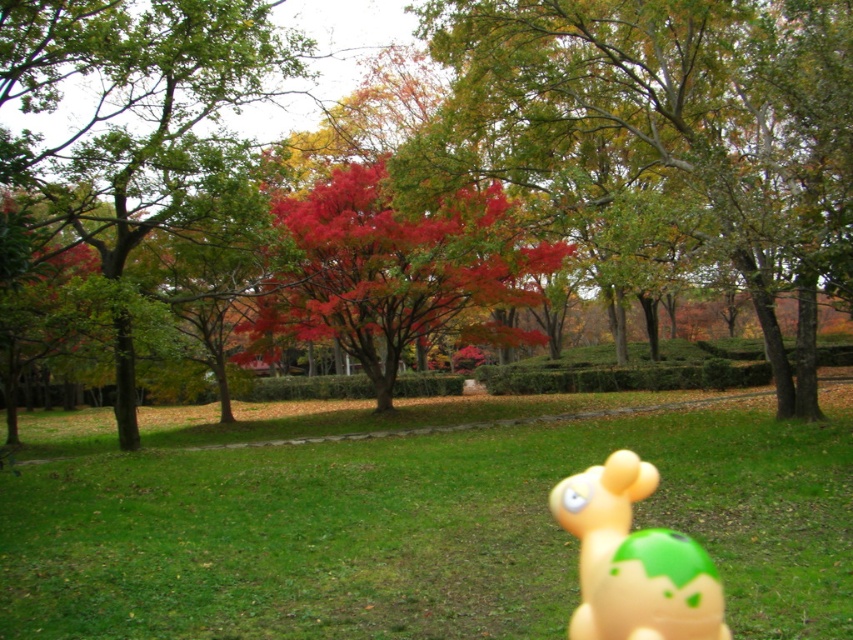
Question: Which of these objects is positioned farthest from the green leafy tree at upper center?

Choices:
 (A) rubber duck at lower right
 (B) reddish-brown bark tree at upper left
 (C) vivid red leaves at center

Answer: (A)

Question: Is green grass at center thinner than green leafy tree at upper center?

Choices:
 (A) no
 (B) yes

Answer: (A)

Question: Is green grass at center positioned at the back of vivid red leaves at center?

Choices:
 (A) no
 (B) yes

Answer: (A)

Question: Does vivid red leaves at center appear under rubber duck at lower right?

Choices:
 (A) yes
 (B) no

Answer: (B)

Question: Which of these objects is positioned closest to the green leafy tree at upper center?

Choices:
 (A) green grass at center
 (B) reddish-brown bark tree at upper left
 (C) rubber duck at lower right
 (D) vivid red leaves at center

Answer: (D)

Question: Which point is farther from the camera taking this photo?

Choices:
 (A) (216, 8)
 (B) (616, 456)
 (C) (701, 461)
 (D) (480, 60)

Answer: (D)